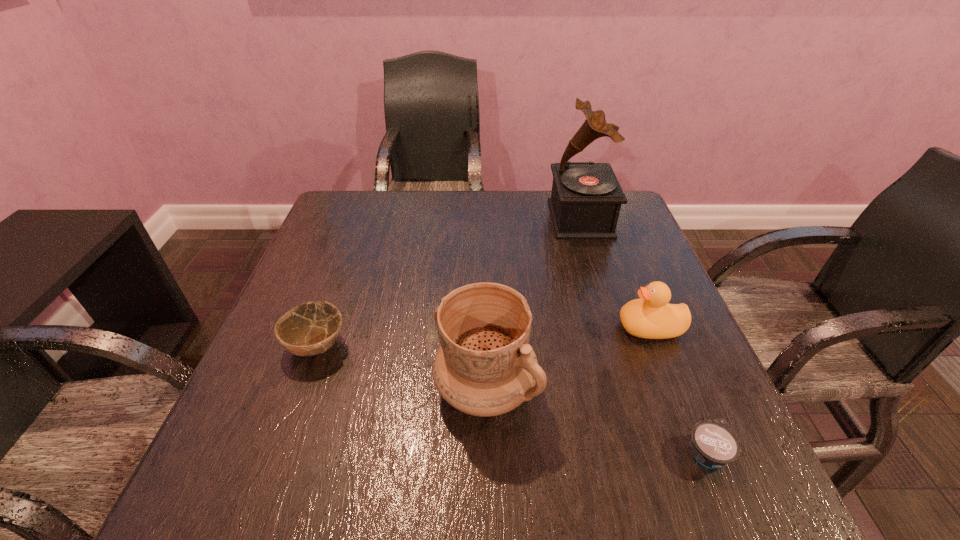
Where is `phonograph_record that is at the right edge`? The image size is (960, 540). phonograph_record that is at the right edge is located at coordinates (586, 198).

Identify the location of duck that is at the right edge. The image size is (960, 540). (652, 317).

In order to click on yogurt located at the right edge in this screenshot , I will do `click(713, 444)`.

I want to click on object at the far right corner, so click(586, 198).

Where is `object that is at the near right corner`? This screenshot has width=960, height=540. object that is at the near right corner is located at coordinates (713, 444).

In the image, there is a desktop. What are the coordinates of `vacant space at the far edge` in the screenshot? It's located at (465, 194).

In the image, there is a desktop. Where is `vacant space at the near edge`? The image size is (960, 540). vacant space at the near edge is located at coordinates (369, 502).

You are a GUI agent. You are given a task and a screenshot of the screen. Output one action in this format:
    pyautogui.click(x=<x>, y=<y>)
    Task: Click on the vacant space at the left edge of the desktop
    This screenshot has width=960, height=540.
    Given the screenshot: What is the action you would take?
    pyautogui.click(x=340, y=243)

This screenshot has width=960, height=540. I want to click on vacant space at the right edge of the desktop, so click(695, 339).

The image size is (960, 540). Identify the location of free space at the far left corner of the desktop. (386, 206).